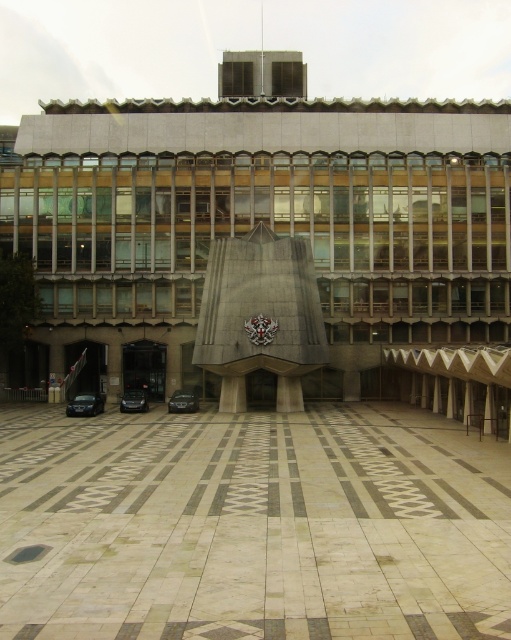
Question: Is beige stone plaza at center bigger than gray concrete sculpture at center?

Choices:
 (A) yes
 (B) no

Answer: (B)

Question: From the image, what is the correct spatial relationship of beige stone plaza at center in relation to shiny black car at center?

Choices:
 (A) below
 (B) above

Answer: (B)

Question: Can you confirm if beige stone plaza at center is positioned below gray concrete sculpture at center?

Choices:
 (A) no
 (B) yes

Answer: (B)

Question: Based on their relative distances, which object is farther from the gray concrete sculpture at center?

Choices:
 (A) shiny silver car at center
 (B) shiny black car at lower left
 (C) shiny black car at center

Answer: (B)

Question: Which of the following is the farthest from the observer?

Choices:
 (A) (295, 307)
 (B) (172, 397)
 (C) (140, 392)
 (D) (176, 524)

Answer: (C)

Question: Which point is closer to the camera?

Choices:
 (A) (244, 349)
 (B) (88, 400)

Answer: (A)